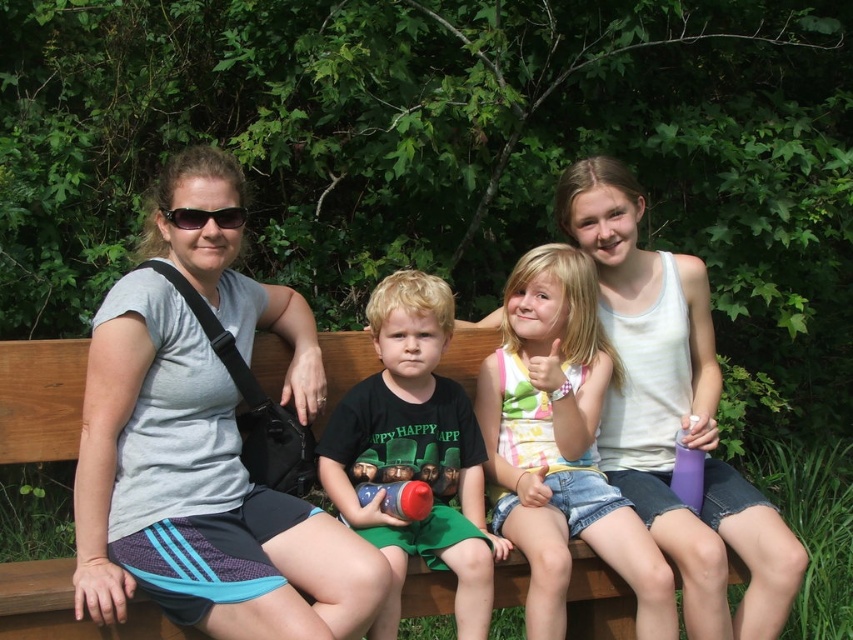
Who is taller, striped cotton shirt at center or green matte shirt at center?

striped cotton shirt at center

The height and width of the screenshot is (640, 853). What do you see at coordinates (561, 444) in the screenshot?
I see `striped cotton shirt at center` at bounding box center [561, 444].

Is point (527, 508) positioned after point (352, 424)?

Yes, point (527, 508) is farther from viewer.

Image resolution: width=853 pixels, height=640 pixels. I want to click on striped cotton shirt at center, so click(561, 444).

Who is positioned more to the left, green matte shirt at center or black plastic sunglasses at upper center?

From the viewer's perspective, black plastic sunglasses at upper center appears more on the left side.

Can you confirm if green matte shirt at center is taller than black plastic sunglasses at upper center?

Answer: Yes, green matte shirt at center is taller than black plastic sunglasses at upper center.

Is point (448, 445) farther from camera compared to point (192, 221)?

Yes, point (448, 445) is behind point (192, 221).

The height and width of the screenshot is (640, 853). What are the coordinates of `green matte shirt at center` in the screenshot? It's located at (415, 452).

Does gray fabric shirt at upper left have a larger size compared to green matte shirt at center?

Yes.

Does gray fabric shirt at upper left have a greater height compared to green matte shirt at center?

Indeed, gray fabric shirt at upper left has a greater height compared to green matte shirt at center.

Where is `gray fabric shirt at upper left`? This screenshot has height=640, width=853. gray fabric shirt at upper left is located at coordinates (677, 419).

What are the coordinates of `gray fabric shirt at upper left` in the screenshot? It's located at (677, 419).